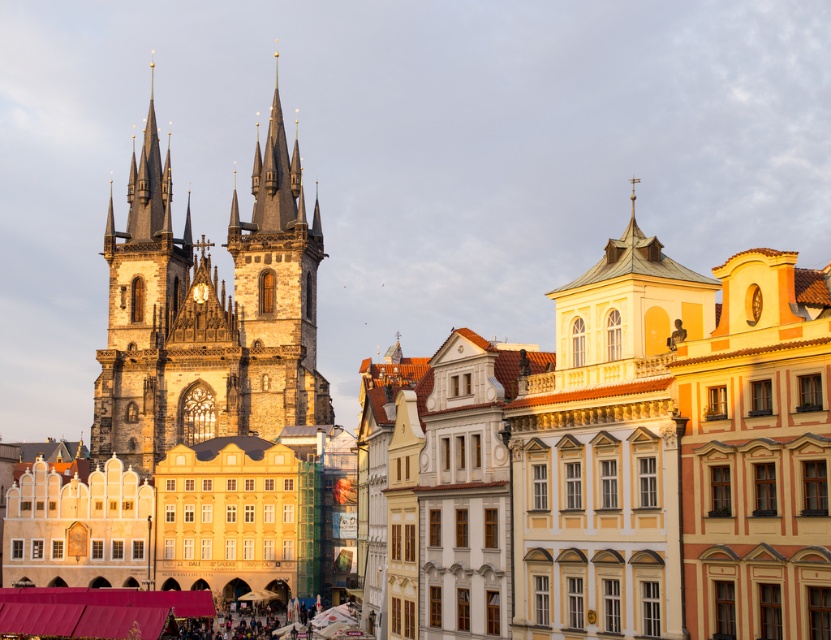
You are a tourist in Old Town Square and want to take a photo that includes both the dark stone tower at left and the dark stone tower at center. Which tower should you position closer to the foreground to ensure both are visible in the frame?

To include both the dark stone tower at left and the dark stone tower at center in the photo, position the dark stone tower at center closer to the foreground since it is shorter than the dark stone tower at left. This way, both towers will be visible within the frame.

You are a tourist standing in the square and want to take a photo that includes both the dark stone tower at left and the dark stone tower at center. Given that your camera can capture a maximum distance of 3 meters between objects in its frame, will you be able to include both towers in the same photo?

The distance between the dark stone tower at left and dark stone tower at center is 3.37 meters. Since your camera can only capture up to 3 meters between objects, the two towers are slightly too far apart to fit within the same photo frame.

You are standing in Old Town Square and want to take a photo that includes both the dark stone tower at left and the dark stone tower at center. Which tower should you position closer to the left side of your camera frame to include both in the shot?

You should position the dark stone tower at left closer to the left side of your camera frame because it is already on the left side of the dark stone tower at center, allowing both to fit within the shot.